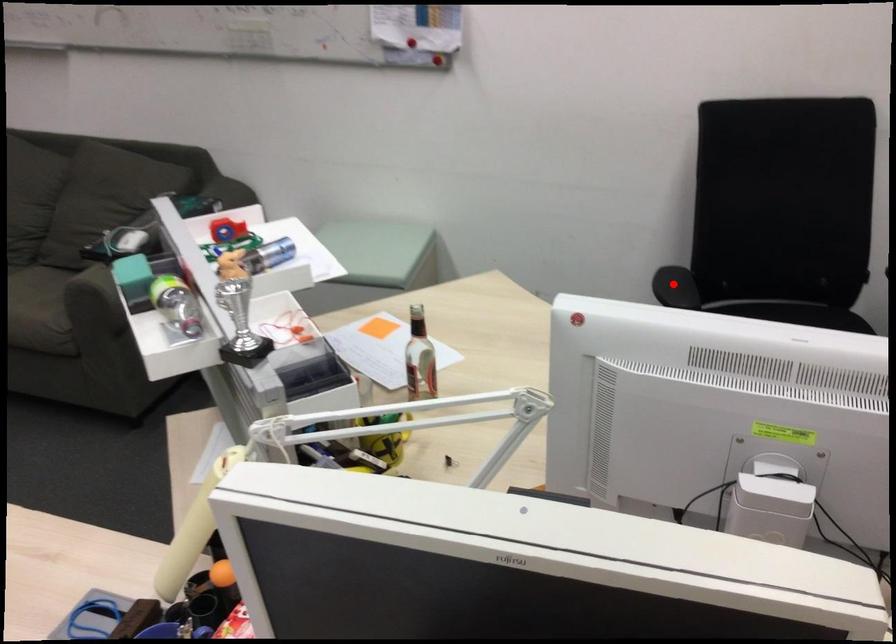
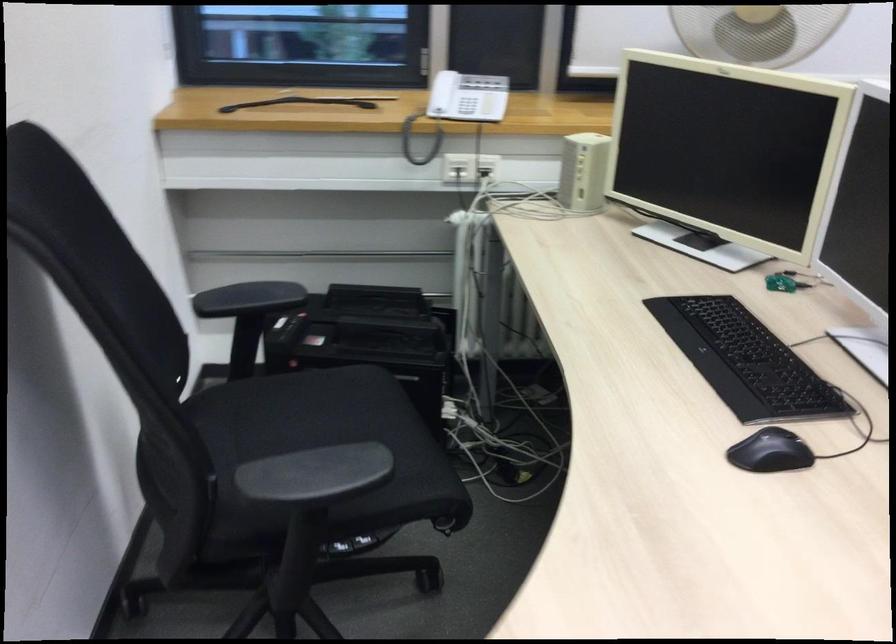
Question: I am providing you with two images of the same scene from different viewpoints. In image1, a red point is highlighted. Considering the same 3D point in image2, which of the following is correct?

Choices:
 (A) It is closer
 (B) It is farther

Answer: (A)